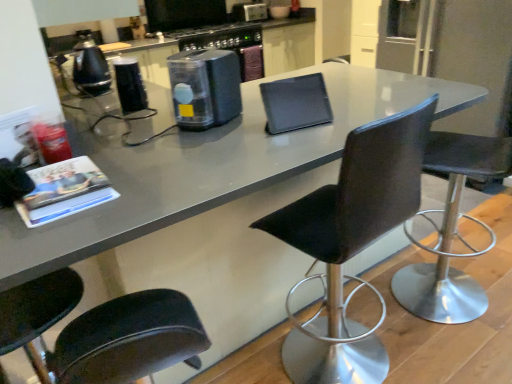
Question: Does point (449, 231) appear closer or farther from the camera than point (60, 175)?

Choices:
 (A) farther
 (B) closer

Answer: (A)

Question: Is black leather chair at right, the third chair from the left, bigger or smaller than matte black magazine at left?

Choices:
 (A) big
 (B) small

Answer: (A)

Question: Based on their relative distances, which object is farther from the matte gray countertop at center?

Choices:
 (A) black leather chair at center, the 2th chair positioned from the right
 (B) metallic silver toaster at upper center, the third appliance from the bottom
 (C) transparent plastic container at center, marked as the 3th appliance in a top-to-bottom arrangement
 (D) black glossy kettle at left, which ranks as the third appliance in right-to-left order
 (E) matte black magazine at left

Answer: (B)

Question: Considering the real-world distances, which object is closest to the black leather chair at center, acting as the second chair starting from the left?

Choices:
 (A) black glossy kettle at left, the second appliance positioned from the bottom
 (B) metallic silver toaster at upper center, arranged as the third appliance when viewed from the front
 (C) black leather chair at right, the first chair in the right-to-left sequence
 (D) matte gray countertop at center
 (E) transparent plastic container at center, marked as the 3th appliance in a top-to-bottom arrangement

Answer: (D)